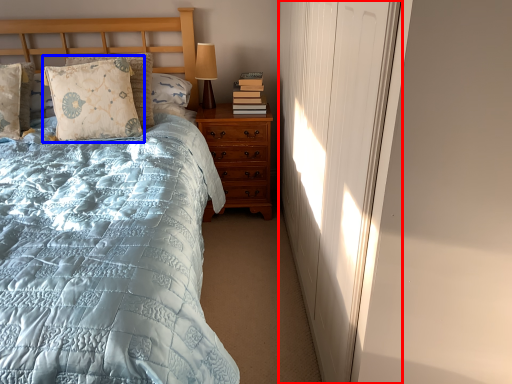
Question: Which object appears farthest to the camera in this image, curtain (highlighted by a red box) or pillow (highlighted by a blue box)?

Choices:
 (A) curtain
 (B) pillow

Answer: (B)